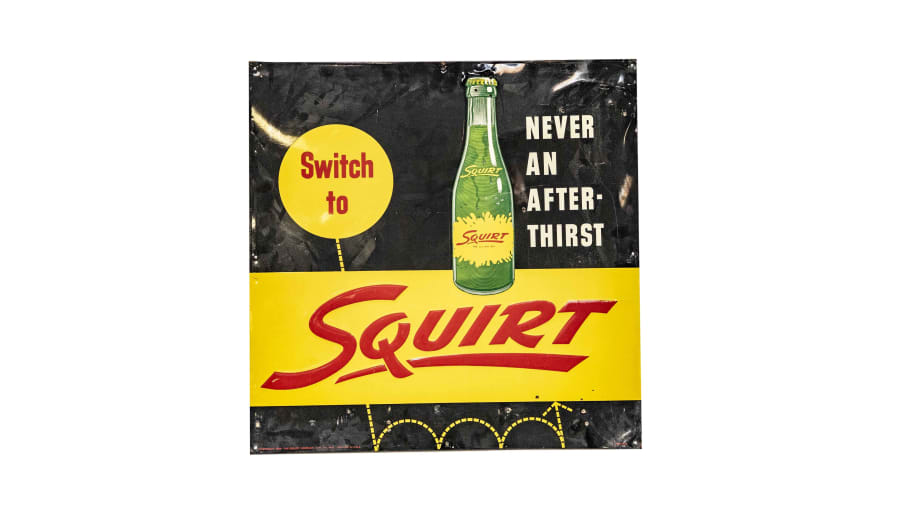
Locate an element on the screen. This screenshot has width=900, height=506. switch is located at coordinates (340, 174).